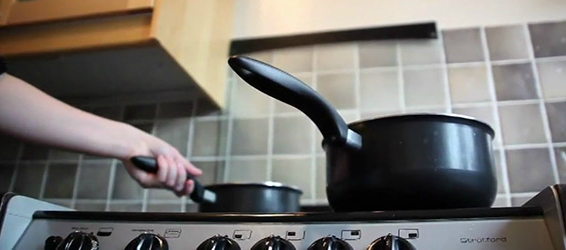
Locate an element on the screen. cabinet is located at coordinates (182, 23).